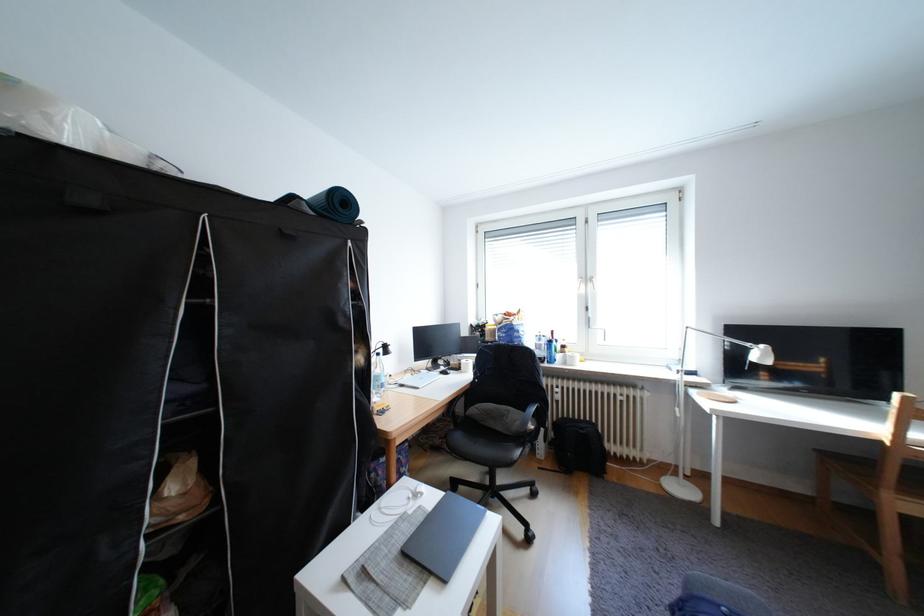
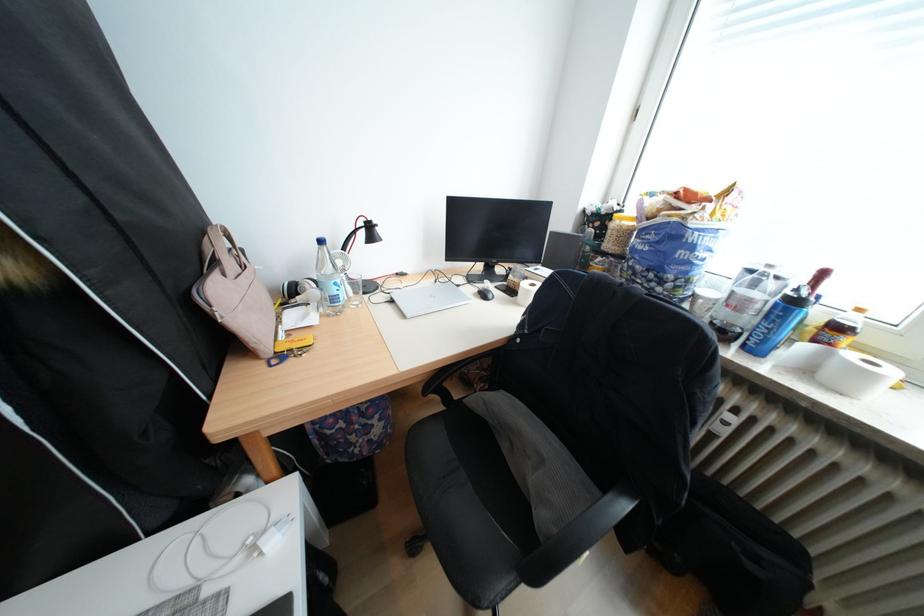
The point at [563,342] is marked in the first image. Where is the corresponding point in the second image?

(808, 302)